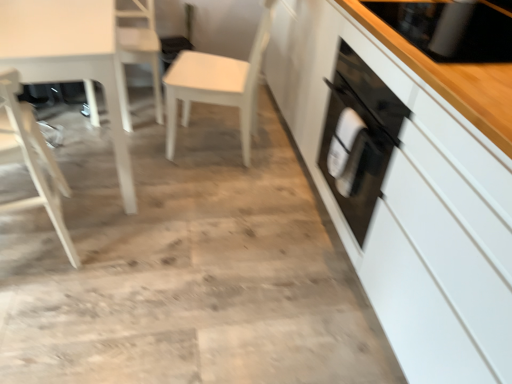
Question: In terms of size, does white matte chair at center, which is the third chair in left-to-right order, appear bigger or smaller than white wood chair at left, which appears as the third chair when viewed from the right?

Choices:
 (A) small
 (B) big

Answer: (B)

Question: In terms of width, does white matte chair at center, which is the third chair in left-to-right order, look wider or thinner when compared to white wood chair at left, which appears as the third chair when viewed from the right?

Choices:
 (A) wide
 (B) thin

Answer: (A)

Question: Estimate the real-world distances between objects in this image. Which object is farther from the white wood chair at left, positioned as the first chair in left-to-right order?

Choices:
 (A) white glossy cabinet at right
 (B) black glass stove at upper right
 (C) white wood chair at upper left, the 2th chair when ordered from left to right
 (D) white glossy table at left
 (E) white matte chair at center, the 1th chair viewed from the right

Answer: (B)

Question: Based on their relative distances, which object is nearer to the white glossy cabinet at right?

Choices:
 (A) white matte chair at center, which is the third chair in left-to-right order
 (B) white wood chair at upper left, positioned as the 2th chair in right-to-left order
 (C) white glossy table at left
 (D) white wood chair at left, which appears as the third chair when viewed from the right
 (E) black glass stove at upper right

Answer: (E)